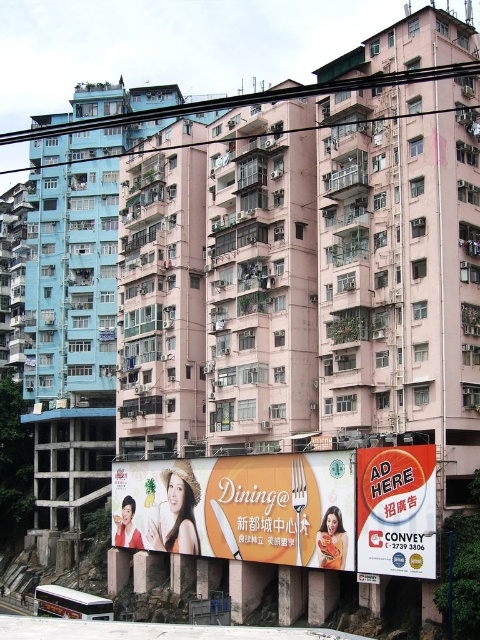
You are a pedestrian standing on the sidewalk in front of the orange glossy billboard at lower center and the orange glossy billboard at center. Which billboard is farther away from you?

The orange glossy billboard at center is farther away because it is positioned behind the orange glossy billboard at lower center.

You are standing in front of the orange glossy billboard at lower center in the urban residential area. You want to take a photo of the billboard without any obstructions. Since the billboard is 55.67 meters away from you, do you think you can capture the entire billboard in your smartphone camera without moving closer?

The orange glossy billboard at lower center is 55.67 meters from viewer. Since smartphones typically have a wide enough angle to capture distant objects clearly, you can likely take a photo of the entire billboard without moving closer.